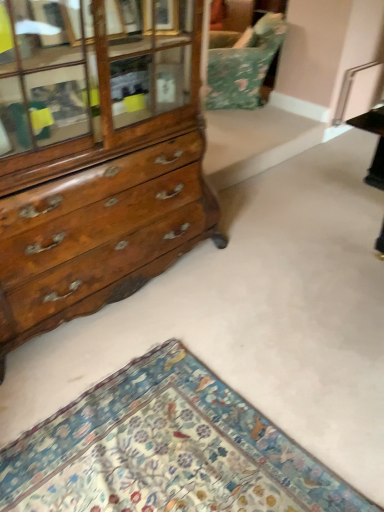
Question: Is wooden chest of drawers at left positioned beyond the bounds of floral fabric swivel chair at upper center?

Choices:
 (A) no
 (B) yes

Answer: (B)

Question: From a real-world perspective, is wooden chest of drawers at left below floral fabric swivel chair at upper center?

Choices:
 (A) no
 (B) yes

Answer: (A)

Question: Does wooden chest of drawers at left have a greater width compared to floral fabric swivel chair at upper center?

Choices:
 (A) yes
 (B) no

Answer: (B)

Question: Is wooden chest of drawers at left at the left side of floral fabric swivel chair at upper center?

Choices:
 (A) yes
 (B) no

Answer: (A)

Question: Would you say floral fabric swivel chair at upper center is part of wooden chest of drawers at left's contents?

Choices:
 (A) no
 (B) yes

Answer: (A)

Question: Is wooden chest of drawers at left aimed at floral fabric swivel chair at upper center?

Choices:
 (A) no
 (B) yes

Answer: (A)

Question: Is the surface of floral carpet at lower left in direct contact with floral fabric swivel chair at upper center?

Choices:
 (A) yes
 (B) no

Answer: (B)

Question: Considering the relative sizes of floral carpet at lower left and floral fabric swivel chair at upper center in the image provided, is floral carpet at lower left smaller than floral fabric swivel chair at upper center?

Choices:
 (A) yes
 (B) no

Answer: (A)

Question: Is floral carpet at lower left facing towards floral fabric swivel chair at upper center?

Choices:
 (A) no
 (B) yes

Answer: (A)

Question: Can you confirm if floral carpet at lower left is positioned to the right of floral fabric swivel chair at upper center?

Choices:
 (A) yes
 (B) no

Answer: (B)

Question: Is floral carpet at lower left not within floral fabric swivel chair at upper center?

Choices:
 (A) yes
 (B) no

Answer: (A)

Question: Is floral carpet at lower left far from floral fabric swivel chair at upper center?

Choices:
 (A) yes
 (B) no

Answer: (A)

Question: Considering the relative positions of wooden chest of drawers at left and floral carpet at lower left in the image provided, is wooden chest of drawers at left in front of floral carpet at lower left?

Choices:
 (A) no
 (B) yes

Answer: (A)